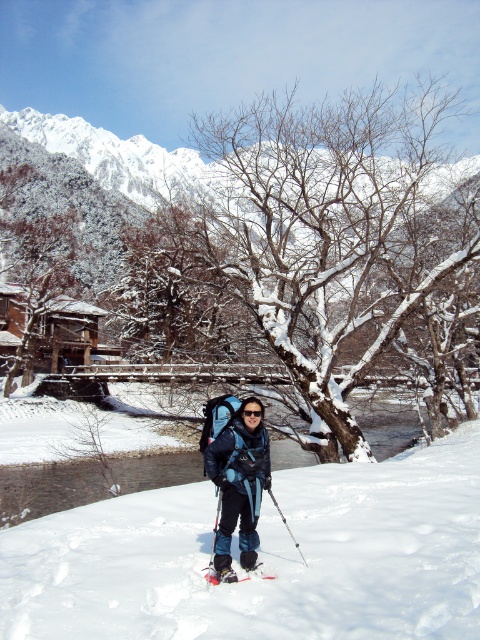
Question: Among these points, which one is nearest to the camera?

Choices:
 (A) (248, 508)
 (B) (249, 408)
 (C) (359, 292)
 (D) (215, 568)

Answer: (D)

Question: Observing the image, what is the correct spatial positioning of shiny metallic ski at center in reference to black plastic ski pole at center?

Choices:
 (A) below
 (B) above

Answer: (A)

Question: Which of these objects is positioned farthest from the shiny metallic ski at center?

Choices:
 (A) white fluffy snow at center
 (B) snowy bark tree at center
 (C) matte black ski pole at center
 (D) black plastic ski pole at center

Answer: (B)

Question: Estimate the real-world distances between objects in this image. Which object is farther from the blue fabric backpack at center?

Choices:
 (A) white fluffy snow at center
 (B) shiny metallic ski at center
 (C) snowy bark tree at center

Answer: (C)

Question: Can you confirm if blue fabric backpack at center is positioned to the left of shiny metallic ski at center?

Choices:
 (A) no
 (B) yes

Answer: (A)

Question: Is the position of snowy bark tree at center more distant than that of blue fabric backpack at center?

Choices:
 (A) no
 (B) yes

Answer: (B)